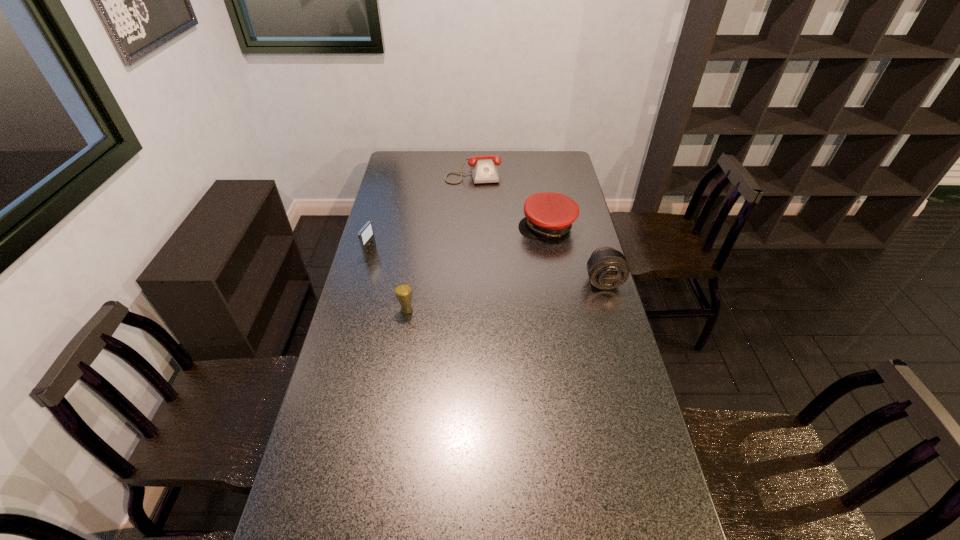
Find the location of a particular element. object situated at the far edge is located at coordinates (484, 169).

You are a GUI agent. You are given a task and a screenshot of the screen. Output one action in this format:
    pyautogui.click(x=<x>, y=<y>)
    Task: Click on the object located in the left edge section of the desktop
    This screenshot has width=960, height=540.
    Given the screenshot: What is the action you would take?
    pyautogui.click(x=366, y=235)

In order to click on telephoto lens situated at the right edge in this screenshot , I will do `click(607, 268)`.

Find the location of `cap present at the right edge`. cap present at the right edge is located at coordinates (547, 214).

In the image, there is a desktop. Where is `vacant space at the far edge`? The height and width of the screenshot is (540, 960). vacant space at the far edge is located at coordinates (430, 159).

The height and width of the screenshot is (540, 960). In order to click on free point at the near edge in this screenshot , I will do `click(410, 524)`.

The width and height of the screenshot is (960, 540). In order to click on free space at the left edge in this screenshot , I will do `click(384, 186)`.

Where is `free space at the right edge of the desktop`? Image resolution: width=960 pixels, height=540 pixels. free space at the right edge of the desktop is located at coordinates (622, 470).

In the image, there is a desktop. Find the location of `free space at the far left corner`. free space at the far left corner is located at coordinates (411, 169).

The width and height of the screenshot is (960, 540). I want to click on free space at the far right corner of the desktop, so click(556, 151).